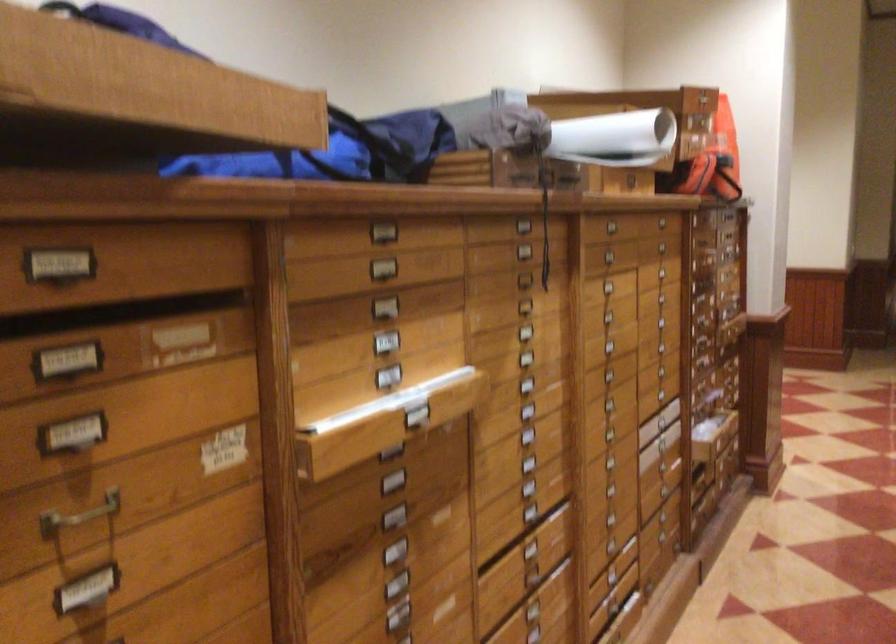
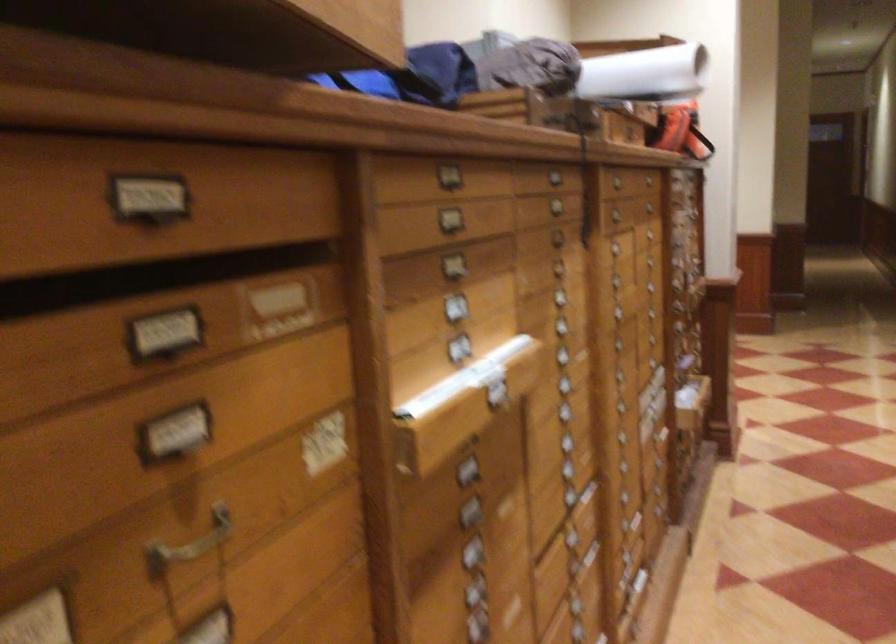
Question: Based on the continuous images, in which direction is the camera rotating? Reply with the corresponding letter.

Choices:
 (A) Left
 (B) Right
 (C) Up
 (D) Down

Answer: (B)